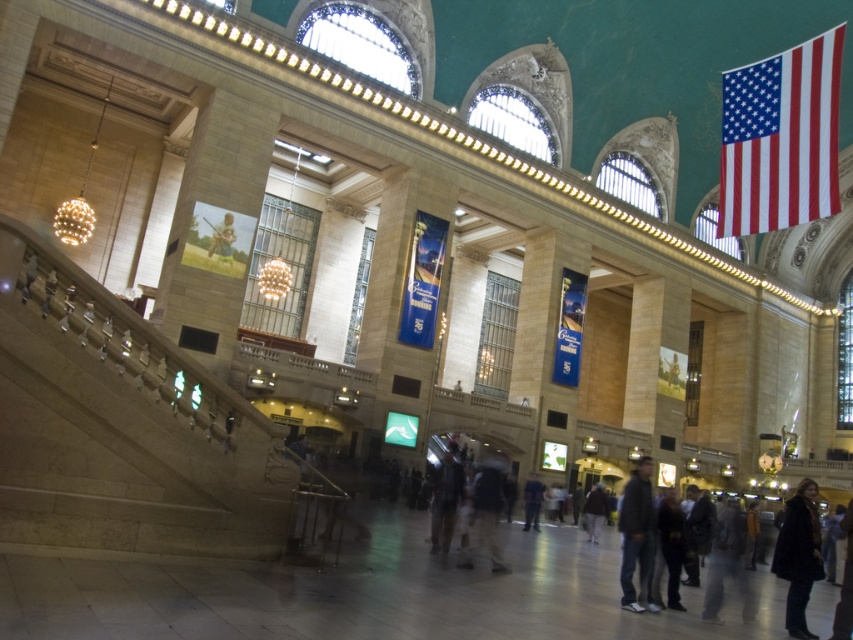
Which is in front, point (637, 483) or point (526, 497)?

Point (637, 483) is in front.

Locate an element on the screen. This screenshot has height=640, width=853. dark gray jacket at lower right is located at coordinates (637, 536).

Which is behind, point (486, 493) or point (670, 493)?

Point (486, 493)

Who is positioned more to the left, light brown fabric pants at center or dark gray pants at lower right?

Positioned to the left is light brown fabric pants at center.

The image size is (853, 640). I want to click on light brown fabric pants at center, so click(x=485, y=515).

Which is more to the right, dark gray jacket at lower right or dark brown leather jacket at center?

dark gray jacket at lower right

Is point (647, 541) farther from viewer compared to point (602, 493)?

No, it is in front of (602, 493).

I want to click on dark gray jacket at lower right, so click(x=637, y=536).